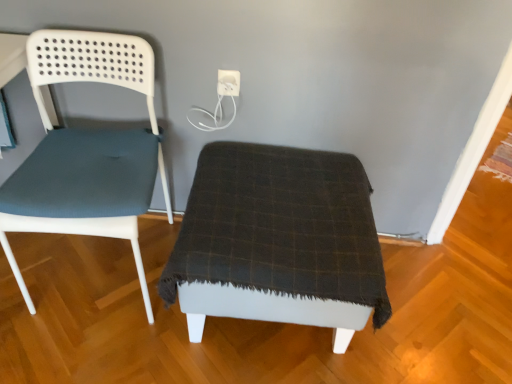
Locate an element on the screen. This screenshot has width=512, height=384. vacant area that lies in front of matte blue fabric chair at left is located at coordinates (91, 352).